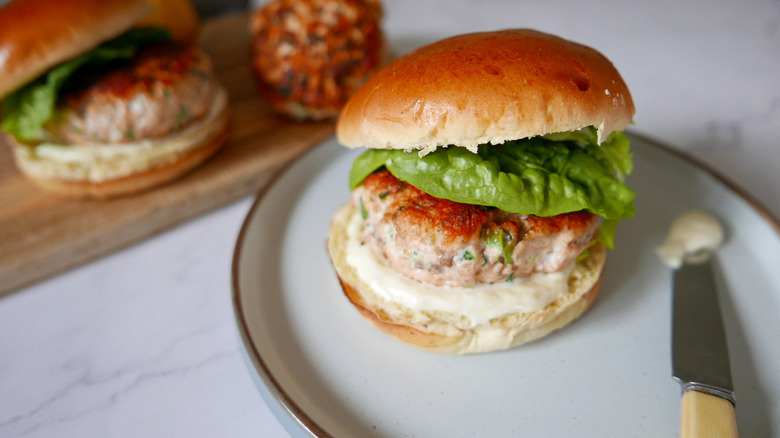
Where is `white surface`? white surface is located at coordinates (119, 292).